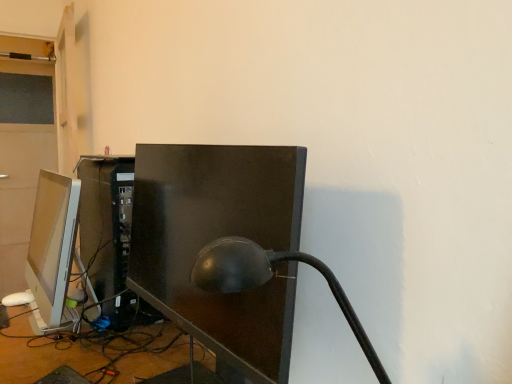
Question: Is matte white monitor at left, the 1th computer monitor in the left-to-right sequence, positioned far away from matte black lamp at center?

Choices:
 (A) no
 (B) yes

Answer: (A)

Question: Is matte white monitor at left, positioned as the second computer monitor in right-to-left order, not within matte black lamp at center?

Choices:
 (A) no
 (B) yes

Answer: (B)

Question: Is matte white monitor at left, the 1th computer monitor in the left-to-right sequence, oriented away from matte black lamp at center?

Choices:
 (A) yes
 (B) no

Answer: (B)

Question: Can you confirm if matte white monitor at left, positioned as the second computer monitor in right-to-left order, is thinner than matte black lamp at center?

Choices:
 (A) yes
 (B) no

Answer: (A)

Question: Does matte white monitor at left, positioned as the second computer monitor in right-to-left order, appear on the left side of matte black lamp at center?

Choices:
 (A) yes
 (B) no

Answer: (A)

Question: From the image's perspective, does matte white monitor at left, the 1th computer monitor in the left-to-right sequence, appear lower than matte black lamp at center?

Choices:
 (A) no
 (B) yes

Answer: (A)

Question: From the image's perspective, is matte black lamp at center over matte black monitor at center, placed as the 1th computer monitor when sorted from right to left?

Choices:
 (A) yes
 (B) no

Answer: (B)

Question: Could you tell me if matte black lamp at center is facing matte black monitor at center, placed as the second computer monitor when sorted from left to right?

Choices:
 (A) no
 (B) yes

Answer: (A)

Question: Does matte black lamp at center touch matte black monitor at center, placed as the 1th computer monitor when sorted from right to left?

Choices:
 (A) yes
 (B) no

Answer: (B)

Question: Is matte black lamp at center bigger than matte black monitor at center, placed as the 1th computer monitor when sorted from right to left?

Choices:
 (A) no
 (B) yes

Answer: (A)

Question: Is matte black monitor at center, placed as the second computer monitor when sorted from left to right, located within matte black lamp at center?

Choices:
 (A) no
 (B) yes

Answer: (A)

Question: Is matte black lamp at center positioned with its back to matte black monitor at center, placed as the 1th computer monitor when sorted from right to left?

Choices:
 (A) yes
 (B) no

Answer: (B)

Question: Does matte black lamp at center have a greater height compared to matte white monitor at left, positioned as the second computer monitor in right-to-left order?

Choices:
 (A) no
 (B) yes

Answer: (A)